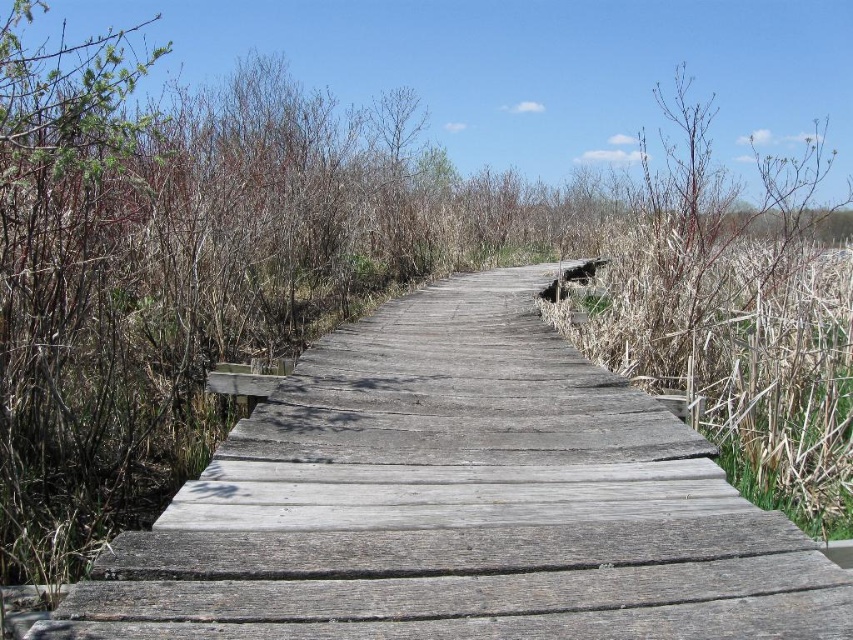
Does weathered wood trail at center have a smaller size compared to dry grass at right?

Correct, weathered wood trail at center occupies less space than dry grass at right.

Which is below, weathered wood trail at center or dry grass at right?

weathered wood trail at center

The height and width of the screenshot is (640, 853). I want to click on weathered wood trail at center, so click(459, 502).